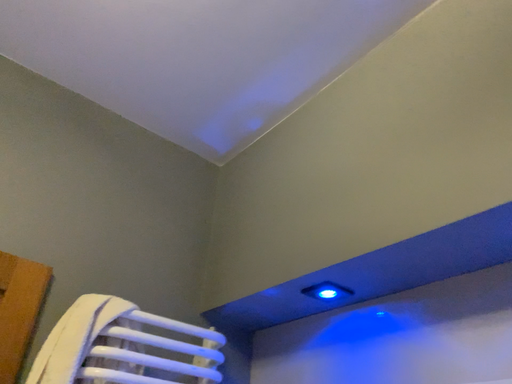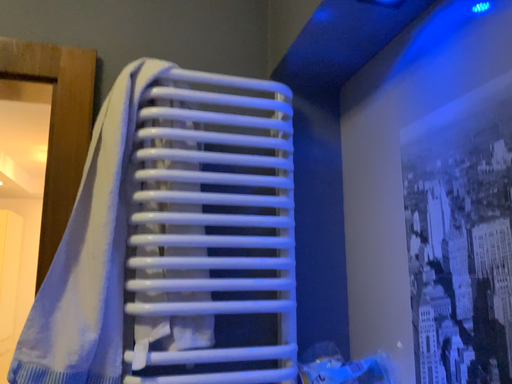
Question: Which way did the camera rotate in the video?

Choices:
 (A) rotated upward
 (B) rotated downward

Answer: (B)